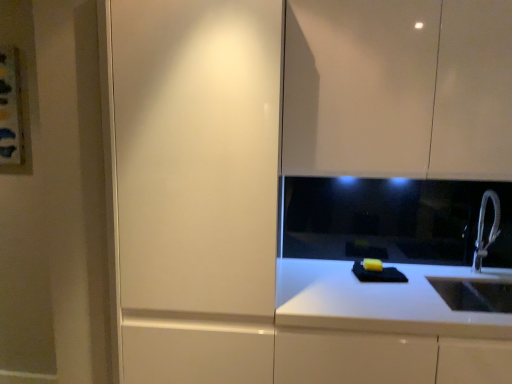
Question: Are matte white cabinet at left and glossy white cabinet at upper right far apart?

Choices:
 (A) no
 (B) yes

Answer: (A)

Question: Is matte white cabinet at left facing away from glossy white cabinet at upper right?

Choices:
 (A) yes
 (B) no

Answer: (B)

Question: Can you confirm if matte white cabinet at left is taller than glossy white cabinet at upper right?

Choices:
 (A) yes
 (B) no

Answer: (A)

Question: Is matte white cabinet at left positioned behind glossy white cabinet at upper right?

Choices:
 (A) yes
 (B) no

Answer: (B)

Question: Can you confirm if matte white cabinet at left is positioned to the left of glossy white cabinet at upper right?

Choices:
 (A) yes
 (B) no

Answer: (A)

Question: Looking at their shapes, would you say glossy white cabinet at upper right is wider or thinner than white glossy countertop at lower right?

Choices:
 (A) wide
 (B) thin

Answer: (B)

Question: In terms of height, does glossy white cabinet at upper right look taller or shorter compared to white glossy countertop at lower right?

Choices:
 (A) tall
 (B) short

Answer: (A)

Question: Considering the positions of glossy white cabinet at upper right and white glossy countertop at lower right in the image, is glossy white cabinet at upper right bigger or smaller than white glossy countertop at lower right?

Choices:
 (A) small
 (B) big

Answer: (A)

Question: From the image's perspective, relative to white glossy countertop at lower right, is glossy white cabinet at upper right above or below?

Choices:
 (A) above
 (B) below

Answer: (A)

Question: From their relative heights in the image, would you say white metallic faucet at right is taller or shorter than glossy white cabinet at upper right?

Choices:
 (A) tall
 (B) short

Answer: (B)

Question: In the image, is white metallic faucet at right positioned in front of or behind glossy white cabinet at upper right?

Choices:
 (A) front
 (B) behind

Answer: (B)

Question: Which is correct: white metallic faucet at right is inside glossy white cabinet at upper right, or outside of it?

Choices:
 (A) inside
 (B) outside

Answer: (B)

Question: Looking at their shapes, would you say white metallic faucet at right is wider or thinner than glossy white cabinet at upper right?

Choices:
 (A) thin
 (B) wide

Answer: (A)

Question: In the image, is matte white cabinet at left positioned in front of or behind white metallic faucet at right?

Choices:
 (A) front
 (B) behind

Answer: (A)

Question: Is matte white cabinet at left wider or thinner than white metallic faucet at right?

Choices:
 (A) wide
 (B) thin

Answer: (A)